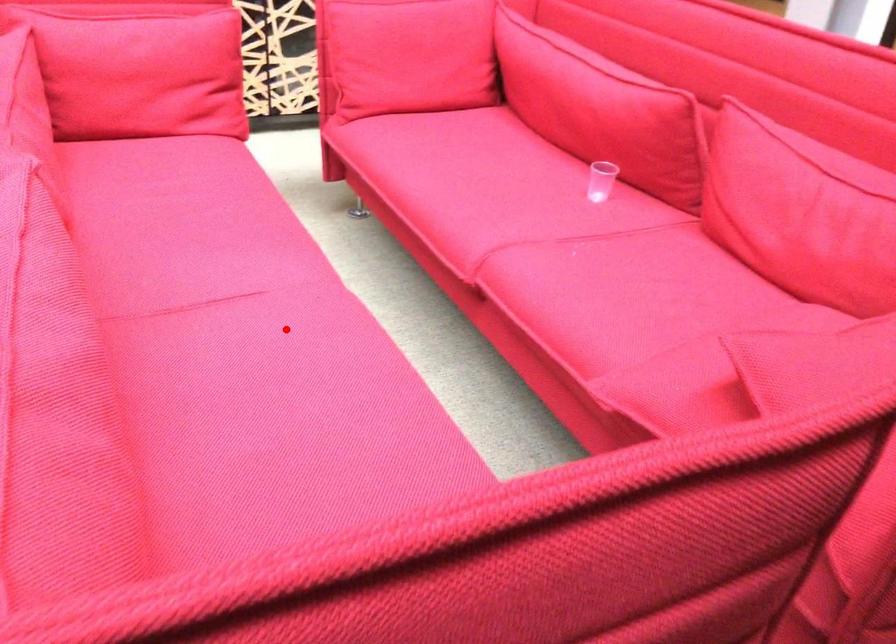
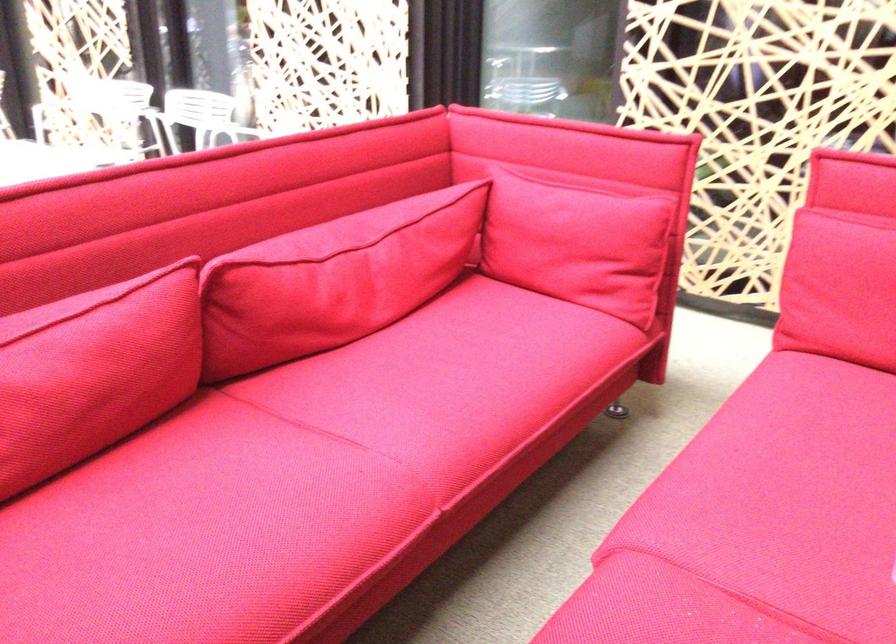
Locate, in the second image, the point that corresponds to the highlighted location in the first image.

(298, 476)